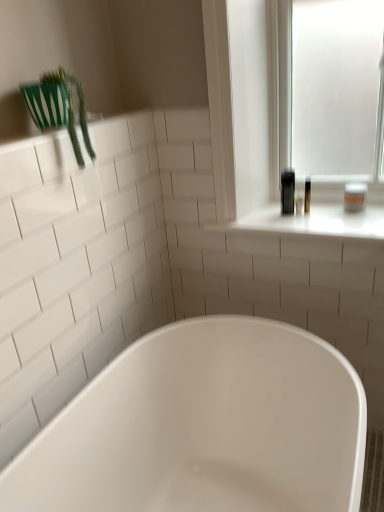
Question: Do you think white glossy bathtub at center is within green plastic plant at upper left, or outside of it?

Choices:
 (A) inside
 (B) outside

Answer: (B)

Question: From their relative heights in the image, would you say white glossy bathtub at center is taller or shorter than green plastic plant at upper left?

Choices:
 (A) short
 (B) tall

Answer: (B)

Question: Which is nearer to the white glossy bathtub at center?

Choices:
 (A) white glossy window sill at upper right
 (B) white matte jar at upper right
 (C) green plastic plant at upper left

Answer: (A)

Question: Which of these objects is positioned closest to the white glossy bathtub at center?

Choices:
 (A) white glossy window sill at upper right
 (B) green plastic plant at upper left
 (C) white matte jar at upper right

Answer: (A)